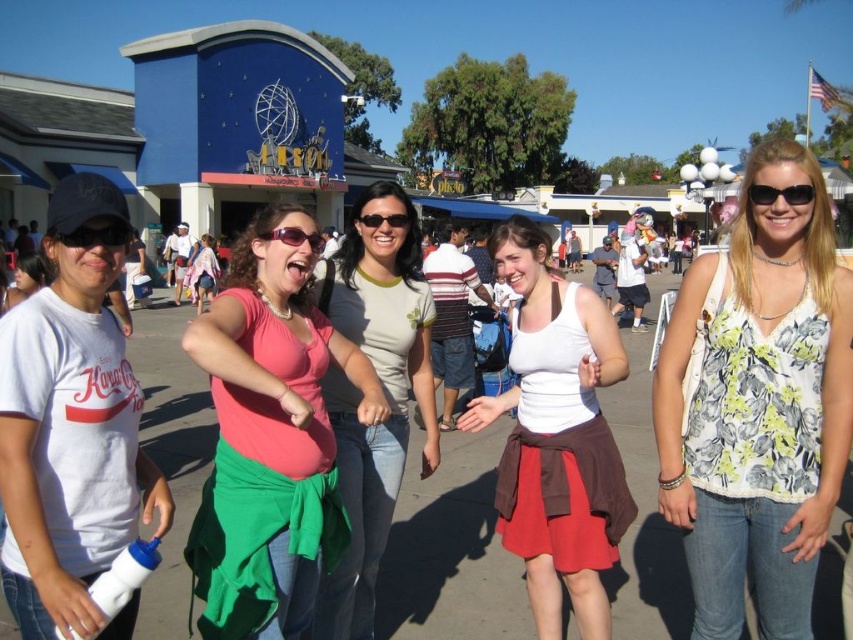
Does floral print tank top at center appear over pink fabric skirt at center?

Correct, floral print tank top at center is located above pink fabric skirt at center.

Where is `floral print tank top at center`? This screenshot has width=853, height=640. floral print tank top at center is located at coordinates (759, 404).

Is white matte t-shirt at left in front of matte pink sunglasses at center?

Yes, it is.

Between white matte t-shirt at left and matte pink sunglasses at center, which one has more height?

With more height is white matte t-shirt at left.

Does point (107, 454) come behind point (306, 234)?

No, (107, 454) is closer to viewer.

Find the location of a particular element. Image resolution: width=853 pixels, height=640 pixels. white matte t-shirt at left is located at coordinates click(71, 432).

Can you confirm if floral print tank top at center is bigger than white matte t-shirt at left?

Incorrect, floral print tank top at center is not larger than white matte t-shirt at left.

Can you confirm if floral print tank top at center is shorter than white matte t-shirt at left?

No.

Where is `floral print tank top at center`? This screenshot has width=853, height=640. floral print tank top at center is located at coordinates (759, 404).